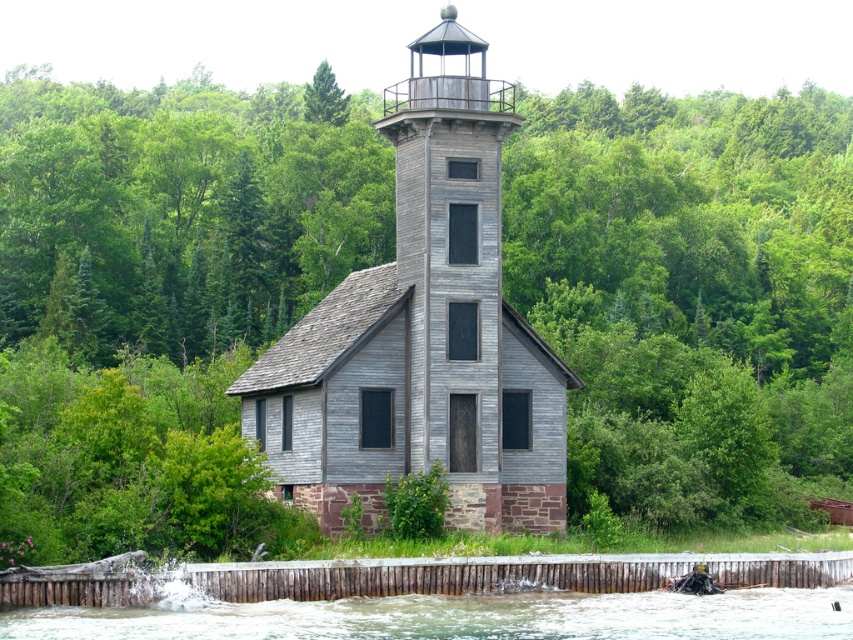
Question: Is gray wood tower at center positioned behind white frothy water at lower center?

Choices:
 (A) yes
 (B) no

Answer: (A)

Question: Can you confirm if gray wood tower at center is smaller than white frothy water at lower center?

Choices:
 (A) yes
 (B) no

Answer: (B)

Question: Where is gray wood tower at center located in relation to white frothy water at lower center in the image?

Choices:
 (A) below
 (B) above

Answer: (B)

Question: Which of the following is the farthest from the observer?

Choices:
 (A) gray wood tower at center
 (B) white frothy water at lower center

Answer: (A)